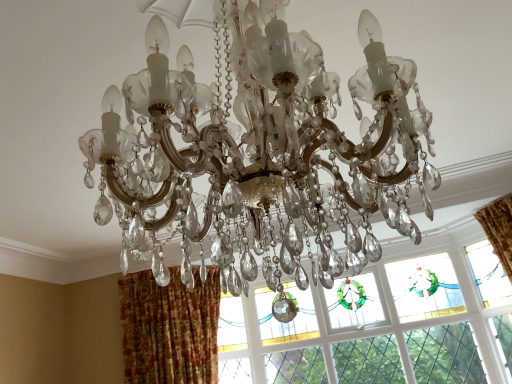
Question: Is the position of textured orange curtain at lower left less distant than that of clear crystal chandelier at center?

Choices:
 (A) no
 (B) yes

Answer: (A)

Question: Considering the relative sizes of textured orange curtain at lower left and clear crystal chandelier at center in the image provided, is textured orange curtain at lower left thinner than clear crystal chandelier at center?

Choices:
 (A) yes
 (B) no

Answer: (A)

Question: From a real-world perspective, is textured orange curtain at lower left below clear crystal chandelier at center?

Choices:
 (A) no
 (B) yes

Answer: (B)

Question: Is textured orange curtain at lower left aimed at clear crystal chandelier at center?

Choices:
 (A) yes
 (B) no

Answer: (A)

Question: Is textured orange curtain at lower left shorter than clear crystal chandelier at center?

Choices:
 (A) no
 (B) yes

Answer: (A)

Question: Is textured orange curtain at lower left to the left or to the right of clear crystal chandelier at center in the image?

Choices:
 (A) right
 (B) left

Answer: (B)

Question: Looking at their shapes, would you say textured orange curtain at lower left is wider or thinner than clear crystal chandelier at center?

Choices:
 (A) wide
 (B) thin

Answer: (B)

Question: Is textured orange curtain at lower left taller or shorter than clear crystal chandelier at center?

Choices:
 (A) short
 (B) tall

Answer: (B)

Question: From the image's perspective, is textured orange curtain at lower left above or below clear crystal chandelier at center?

Choices:
 (A) above
 (B) below

Answer: (B)

Question: Relative to textured orange curtain at lower left, is clear crystal chandelier at center in front or behind?

Choices:
 (A) front
 (B) behind

Answer: (A)

Question: From the image's perspective, relative to textured orange curtain at lower left, is clear crystal chandelier at center above or below?

Choices:
 (A) above
 (B) below

Answer: (A)

Question: In terms of width, does clear crystal chandelier at center look wider or thinner when compared to textured orange curtain at lower left?

Choices:
 (A) thin
 (B) wide

Answer: (B)

Question: Is clear crystal chandelier at center spatially inside textured orange curtain at lower left, or outside of it?

Choices:
 (A) outside
 (B) inside

Answer: (A)

Question: From a real-world perspective, relative to stained glass window at center, is clear crystal chandelier at center vertically above or below?

Choices:
 (A) above
 (B) below

Answer: (A)

Question: Based on their sizes in the image, would you say clear crystal chandelier at center is bigger or smaller than stained glass window at center?

Choices:
 (A) small
 (B) big

Answer: (B)